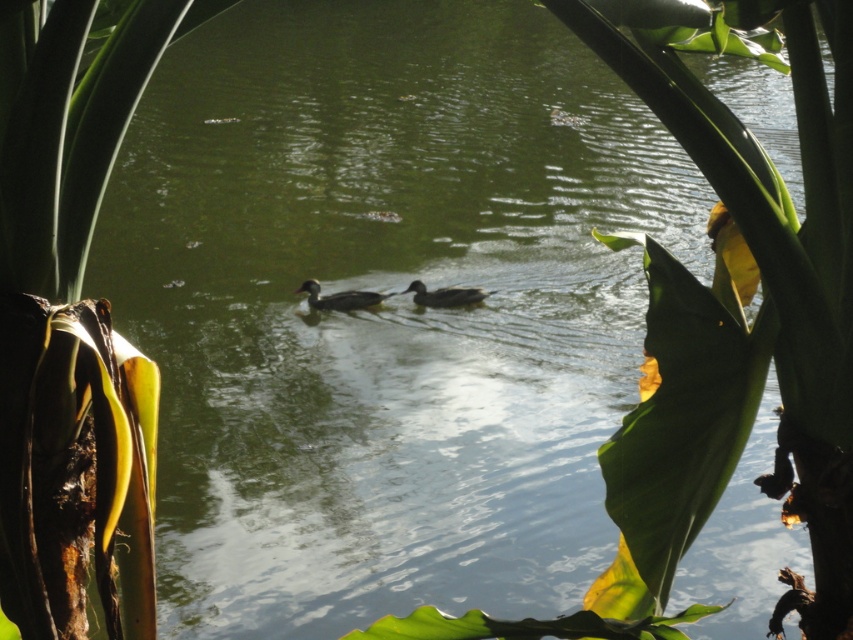
You are a photographer trying to capture both the dark brown glossy duck at center and the dark gray matte duck at center in a single shot. Since you want to highlight their positions relative to each other, which duck should you focus on first if you start from the left side of the frame?

The dark brown glossy duck at center should be focused on first because it is positioned on the left side of the dark gray matte duck at center, so it appears first when moving from left to right.

Based on the photo, you are a birdwatcher observing the ducks in the scene. Which duck, the dark brown glossy duck at center or the dark gray matte duck at center, is closer to you?

The dark brown glossy duck at center is closer to you because it is positioned further to the viewer than the dark gray matte duck at center.